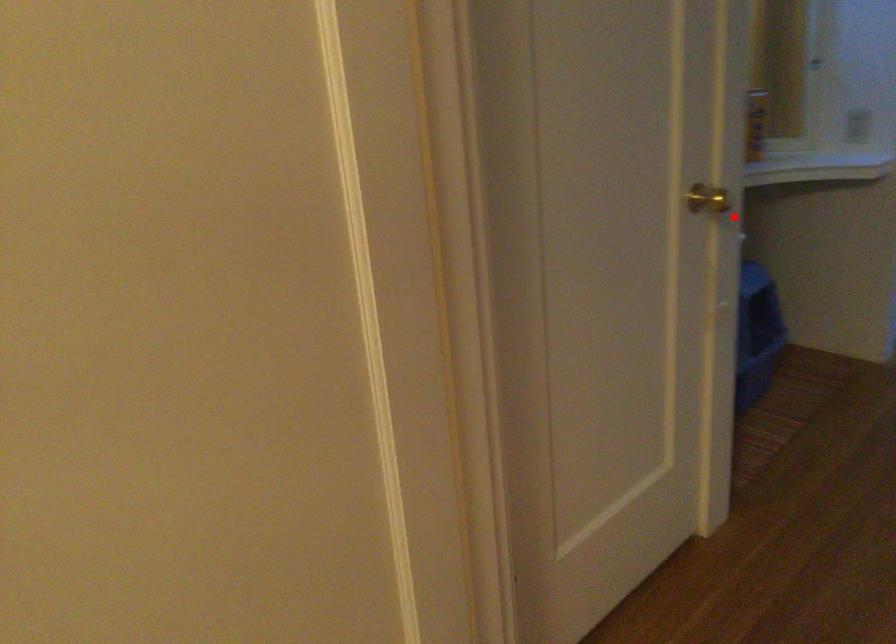
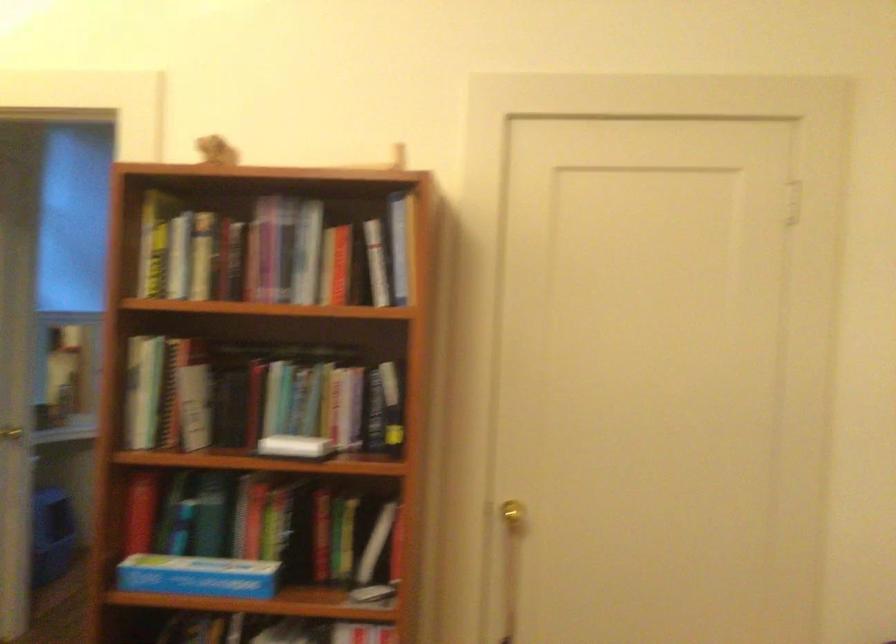
Question: I am providing you with two images of the same scene from different viewpoints. Image1 has a red point marked. In image2, the corresponding 3D location appears at what relative position? Reply with the corresponding letter.

Choices:
 (A) Closer
 (B) Farther

Answer: (B)